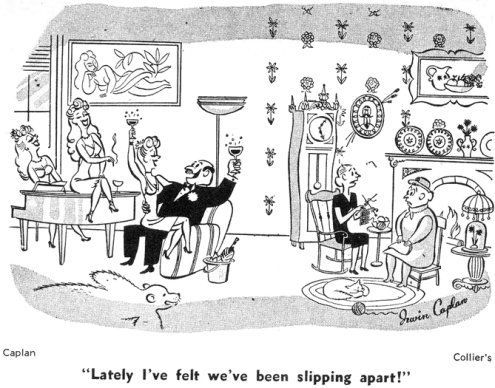
Where is `armchair`? This screenshot has height=388, width=495. armchair is located at coordinates (209, 237).